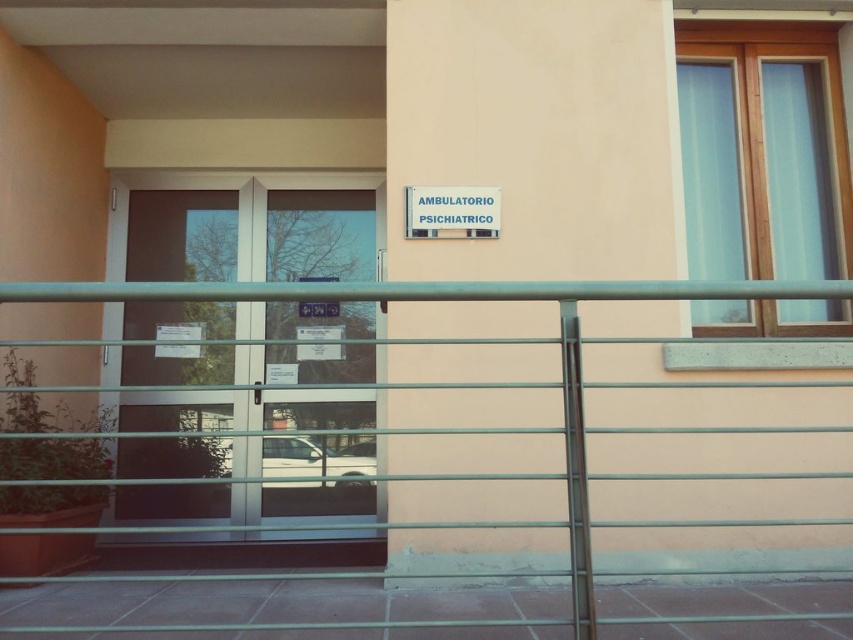
Measure the distance between transparent glass door at center and white plastic sign at upper center.

They are 1.08 meters apart.

Between transparent glass door at center and white plastic sign at upper center, which one is positioned higher?

white plastic sign at upper center is higher up.

Does point (122, 422) come in front of point (434, 196)?

No, (122, 422) is further to viewer.

Where is `transparent glass door at center`? The image size is (853, 640). transparent glass door at center is located at coordinates (247, 436).

Is point (589, 291) behind point (466, 214)?

No, it is in front of (466, 214).

Describe the element at coordinates (473, 300) in the screenshot. The height and width of the screenshot is (640, 853). I see `metallic silver fence at center` at that location.

Where is `metallic silver fence at center`? The height and width of the screenshot is (640, 853). metallic silver fence at center is located at coordinates (473, 300).

Which of these two, transparent glass door at center or metallic silver fence at center, stands taller?

With more height is transparent glass door at center.

How much distance is there between transparent glass door at center and metallic silver fence at center?

transparent glass door at center is 5.19 feet from metallic silver fence at center.

Where is `transparent glass door at center`? The image size is (853, 640). transparent glass door at center is located at coordinates (247, 436).